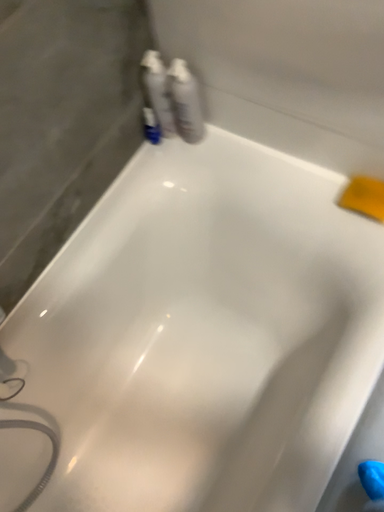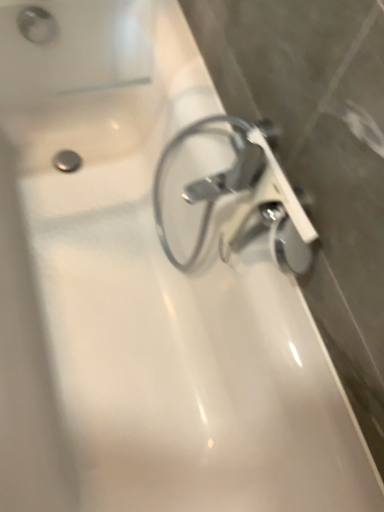
Question: How did the camera likely rotate when shooting the video?

Choices:
 (A) rotated right
 (B) rotated left

Answer: (B)